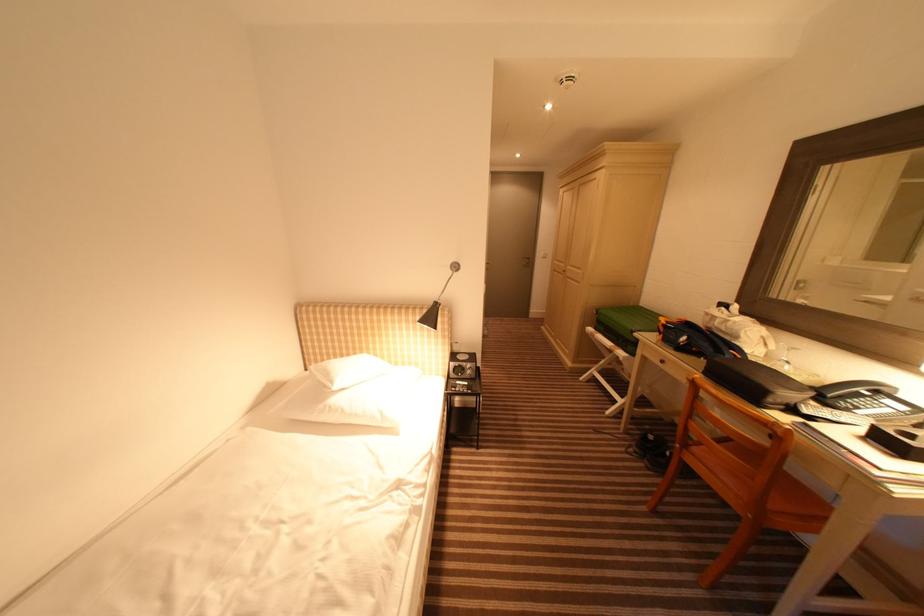
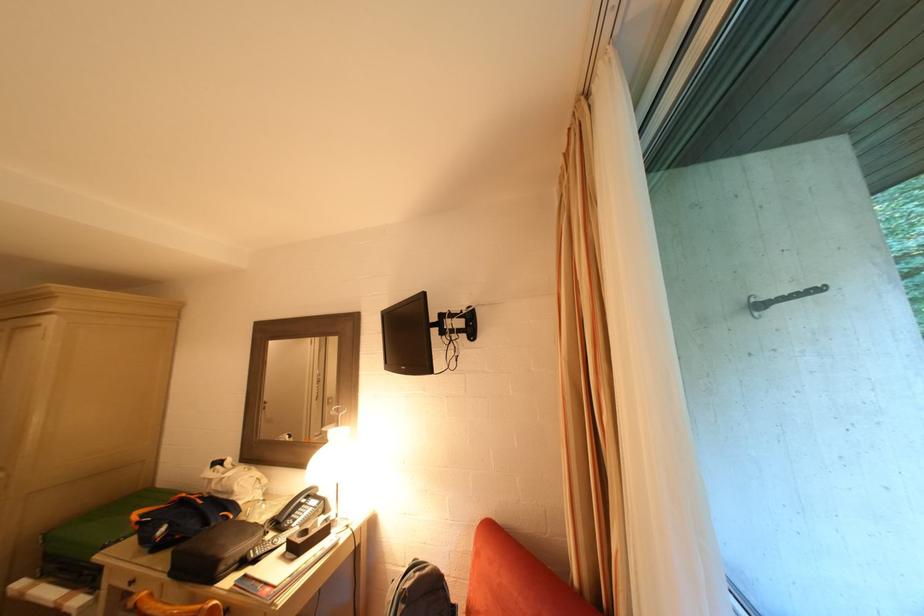
In the second image, find the point that corresponds to point 776,402 in the first image.

(227, 570)